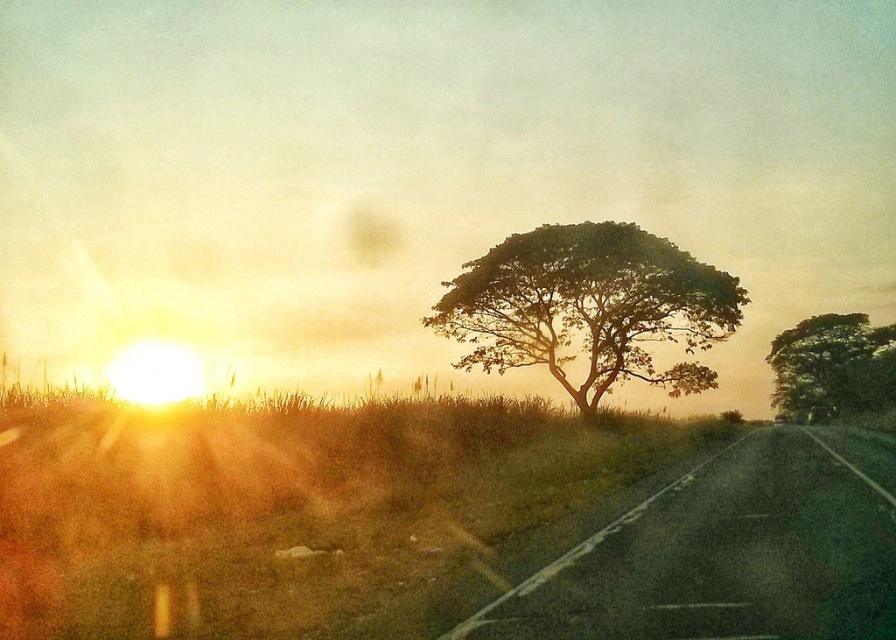
Does green leafy tree at center appear under green leafy tree at right?

No.

Looking at this image, is green leafy tree at center thinner than green leafy tree at right?

→ No.

Between point (696, 378) and point (800, 385), which one is positioned in front?

Point (696, 378)

The height and width of the screenshot is (640, 896). In order to click on green leafy tree at center in this screenshot , I will do `click(589, 307)`.

Is point (765, 445) more distant than point (784, 344)?

No.

Is point (748, 486) closer to camera compared to point (838, 330)?

Yes, point (748, 486) is in front of point (838, 330).

Does point (851, 577) come in front of point (780, 344)?

Yes, it is.

In order to click on black asphalt highway at lower right in this screenshot , I will do `click(727, 554)`.

Which is more to the left, black asphalt highway at lower right or green leafy tree at center?

From the viewer's perspective, green leafy tree at center appears more on the left side.

Between point (821, 536) and point (675, 252), which one is positioned behind?

The point (675, 252) is more distant.

Locate an element on the screen. This screenshot has width=896, height=640. black asphalt highway at lower right is located at coordinates (727, 554).